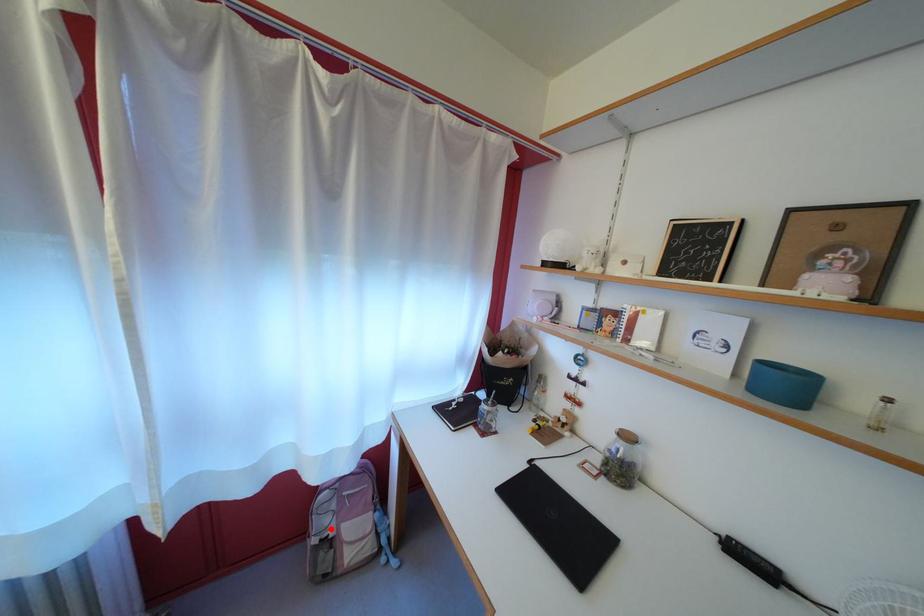
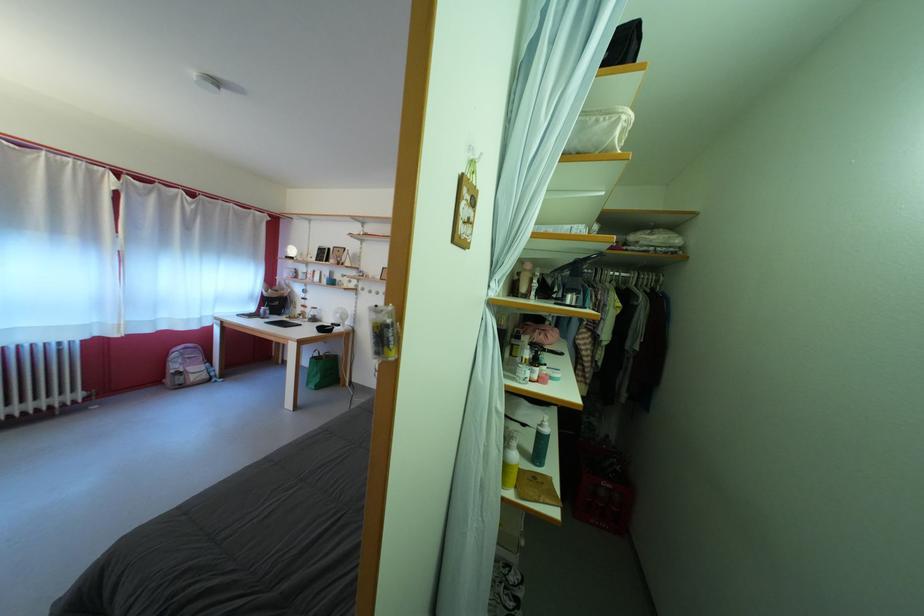
Find the pixel in the second image that matches the highlighted location in the first image.

(184, 373)